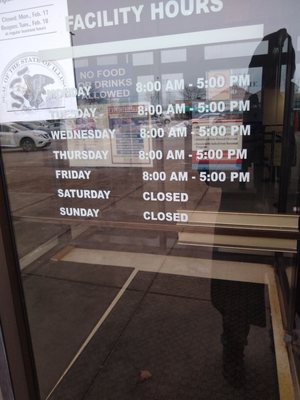
Find the location of a particular element. This screenshot has height=400, width=300. shoe as reflected in glass pane is located at coordinates (234, 374).